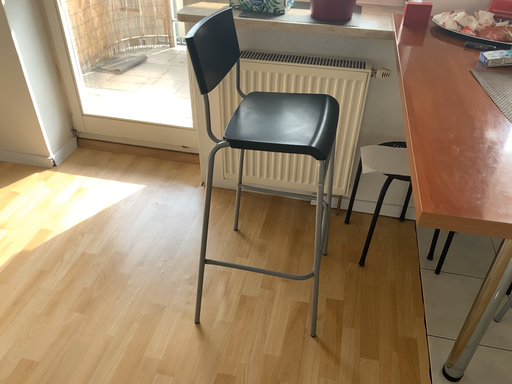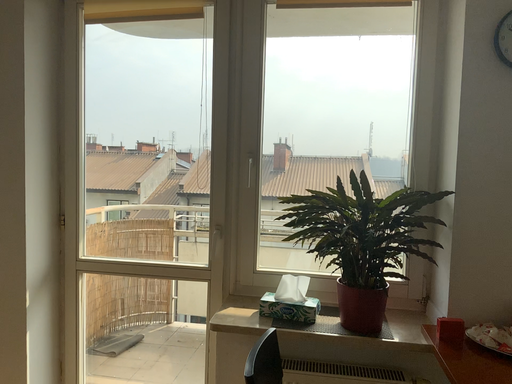
Question: Which way did the camera rotate in the video?

Choices:
 (A) rotated upward
 (B) rotated downward

Answer: (A)